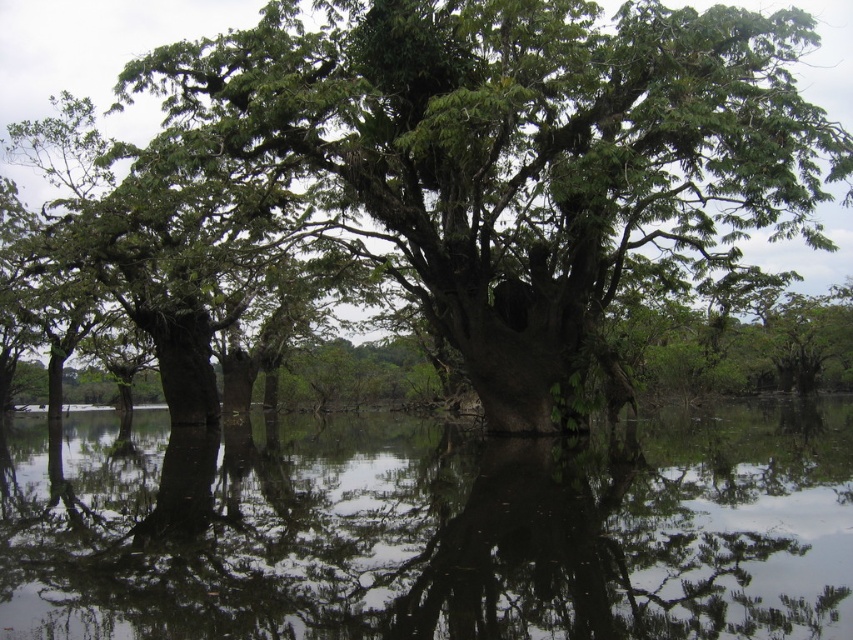
Is the position of clear water at center less distant than that of green rough bark tree at center?

Result: That is True.

Consider the image. Can you confirm if clear water at center is positioned below green rough bark tree at center?

Correct, clear water at center is located below green rough bark tree at center.

This screenshot has height=640, width=853. In order to click on clear water at center in this screenshot , I will do `click(428, 529)`.